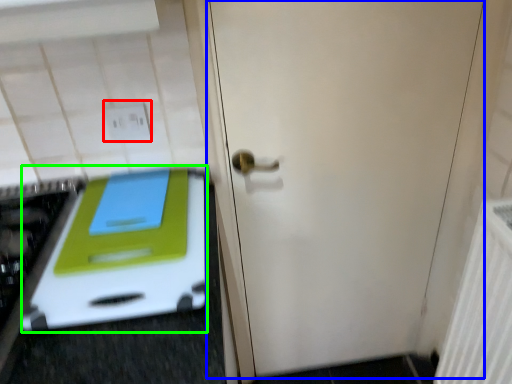
Question: Which is farther away from electric outlet (highlighted by a red box)? door (highlighted by a blue box) or oven (highlighted by a green box)?

Choices:
 (A) door
 (B) oven

Answer: (A)